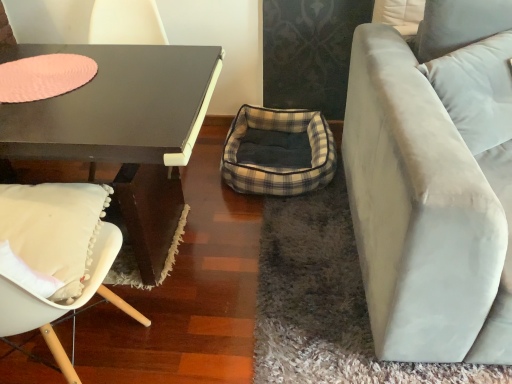
The image size is (512, 384). I want to click on free location above matte black coffee table at left (from a real-world perspective), so click(83, 83).